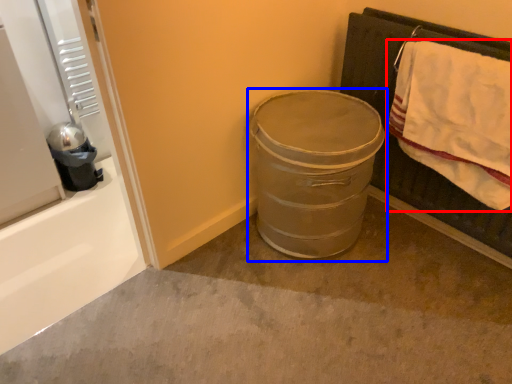
Question: Among these objects, which one is nearest to the camera, bath towel (highlighted by a red box) or trash bin/can (highlighted by a blue box)?

Choices:
 (A) bath towel
 (B) trash bin/can

Answer: (A)